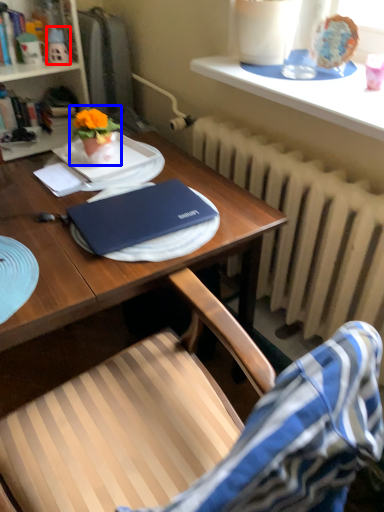
Question: Which of the following is the farthest to the observer, toy (highlighted by a red box) or houseplant (highlighted by a blue box)?

Choices:
 (A) toy
 (B) houseplant

Answer: (A)